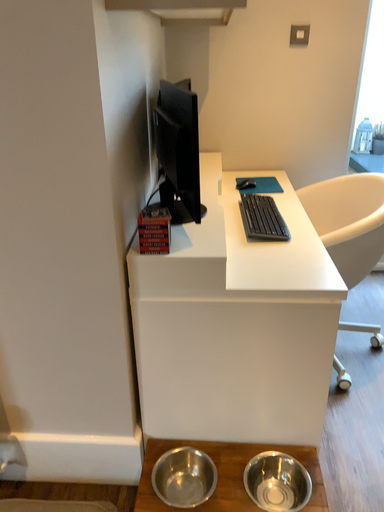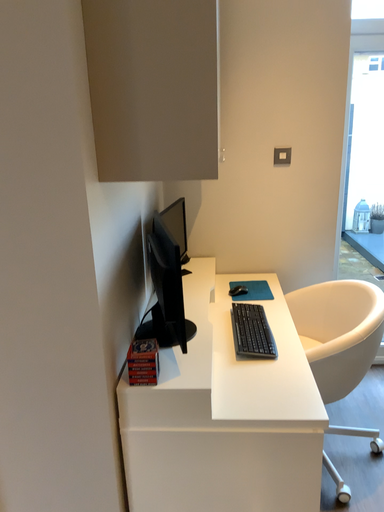
Question: Which way did the camera rotate in the video?

Choices:
 (A) rotated upward
 (B) rotated downward

Answer: (A)